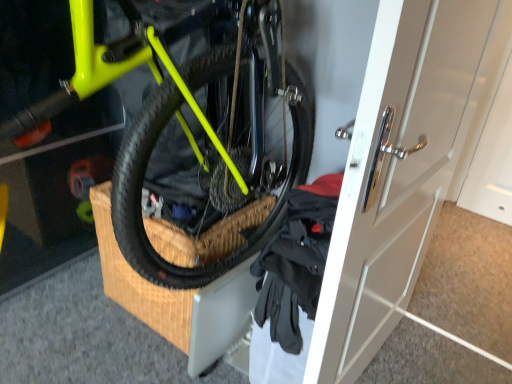
Question: Considering the relative sizes of neon yellow matte bicycle at center and black fabric gloves at lower right in the image provided, is neon yellow matte bicycle at center shorter than black fabric gloves at lower right?

Choices:
 (A) yes
 (B) no

Answer: (B)

Question: From a real-world perspective, is neon yellow matte bicycle at center below black fabric gloves at lower right?

Choices:
 (A) yes
 (B) no

Answer: (B)

Question: Can you see neon yellow matte bicycle at center touching black fabric gloves at lower right?

Choices:
 (A) no
 (B) yes

Answer: (A)

Question: Is neon yellow matte bicycle at center completely or partially outside of black fabric gloves at lower right?

Choices:
 (A) no
 (B) yes

Answer: (B)

Question: Is black fabric gloves at lower right inside neon yellow matte bicycle at center?

Choices:
 (A) yes
 (B) no

Answer: (A)

Question: Is point (158, 178) closer or farther from the camera than point (282, 233)?

Choices:
 (A) farther
 (B) closer

Answer: (A)

Question: From the image's perspective, is neon yellow matte bicycle at center above or below black fabric gloves at lower right?

Choices:
 (A) below
 (B) above

Answer: (B)

Question: From a real-world perspective, is neon yellow matte bicycle at center positioned above or below black fabric gloves at lower right?

Choices:
 (A) above
 (B) below

Answer: (A)

Question: In terms of height, does neon yellow matte bicycle at center look taller or shorter compared to black fabric gloves at lower right?

Choices:
 (A) tall
 (B) short

Answer: (A)

Question: Considering the positions of white glossy door at center and neon yellow matte bicycle at center in the image, is white glossy door at center bigger or smaller than neon yellow matte bicycle at center?

Choices:
 (A) big
 (B) small

Answer: (B)

Question: In the image, is white glossy door at center on the left side or the right side of neon yellow matte bicycle at center?

Choices:
 (A) left
 (B) right

Answer: (B)

Question: Is white glossy door at center in front of or behind neon yellow matte bicycle at center in the image?

Choices:
 (A) behind
 (B) front

Answer: (A)

Question: Considering the positions of white glossy door at center and neon yellow matte bicycle at center in the image, is white glossy door at center taller or shorter than neon yellow matte bicycle at center?

Choices:
 (A) tall
 (B) short

Answer: (A)

Question: From the image's perspective, is neon yellow matte bicycle at center above or below white glossy door at center?

Choices:
 (A) above
 (B) below

Answer: (A)

Question: In the image, is neon yellow matte bicycle at center positioned in front of or behind white glossy door at center?

Choices:
 (A) behind
 (B) front

Answer: (B)